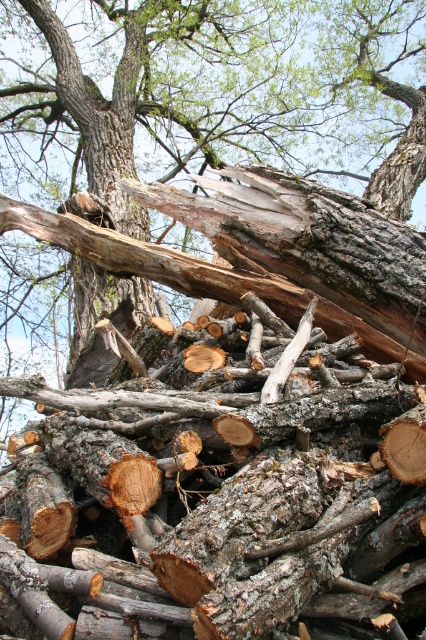
You are trying to decide which tree trunk to use for building a small wooden bench. You have two options in the image, the gray bark tree trunk at center and the gray rough bark tree trunk at upper center. Which one would be more suitable based on their sizes?

The gray bark tree trunk at center is bigger than the gray rough bark tree trunk at upper center, so it would be more suitable for building a small wooden bench as it provides more material.

You are standing at the base of the large tree in the background and looking towards the pile of logs. There are two points marked in the image, point 1 at coordinates point (273, 97) and point 2 at coordinates point (75, 356). Which point is closer to you?

Point (75, 356) is closer to you because it is in front of point (273, 97).